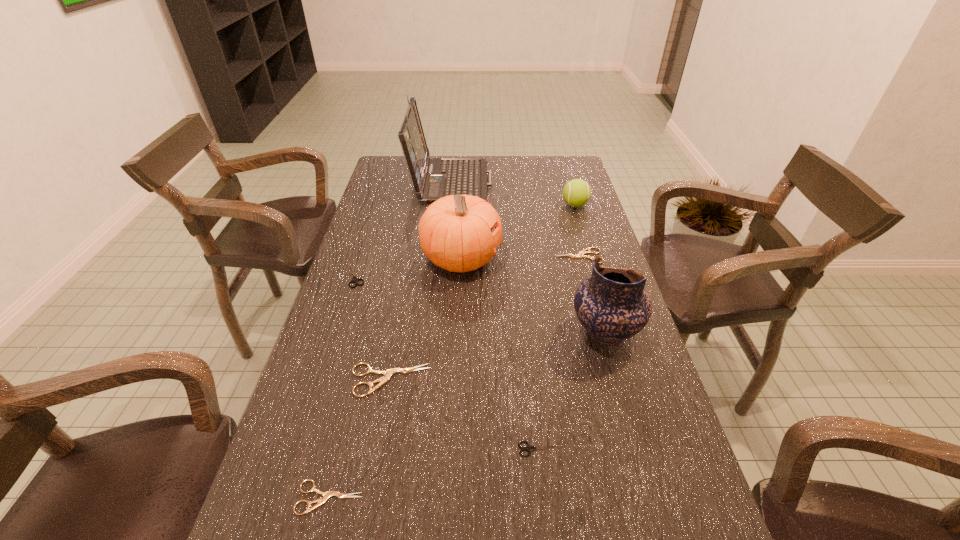
The height and width of the screenshot is (540, 960). Identify the location of vacant position located 0.250m on the front of the biggest beige shears. (365, 518).

Identify the location of free spot located on the right of the farther black shears. Image resolution: width=960 pixels, height=540 pixels. (404, 275).

I want to click on vacant space located on the left of the farthest beige shears, so click(429, 256).

The height and width of the screenshot is (540, 960). Find the location of `free space located on the right of the nearest beige shears`. free space located on the right of the nearest beige shears is located at coordinates (400, 497).

I want to click on free location located on the right of the fourth farthest shears, so click(589, 449).

This screenshot has height=540, width=960. What are the coordinates of `object that is positioned at the far edge` in the screenshot? It's located at (433, 178).

Image resolution: width=960 pixels, height=540 pixels. What are the coordinates of `laptop computer located in the left edge section of the desktop` in the screenshot? It's located at (433, 178).

This screenshot has height=540, width=960. What are the coordinates of `pottery situated at the right edge` in the screenshot? It's located at (612, 304).

Identify the location of tennis ball that is at the right edge. (576, 193).

Locate an element on the screen. shears situated at the right edge is located at coordinates (581, 254).